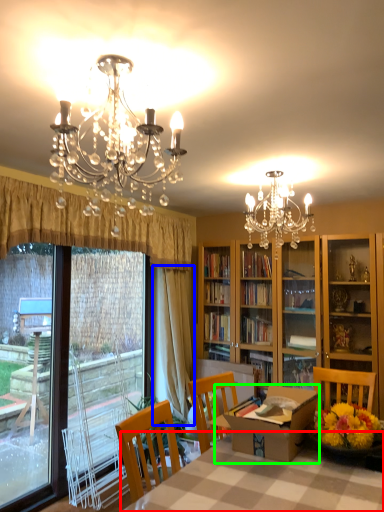
Question: Which object is the closest to the table (highlighted by a red box)? Choose among these: curtain (highlighted by a blue box) or round table (highlighted by a green box).

Choices:
 (A) curtain
 (B) round table

Answer: (B)